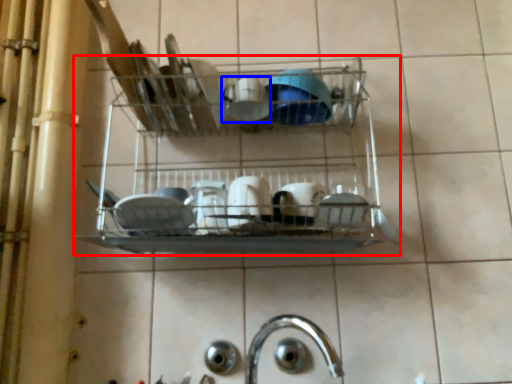
Question: Which object is further to the camera taking this photo, shelf (highlighted by a red box) or tableware (highlighted by a blue box)?

Choices:
 (A) shelf
 (B) tableware

Answer: (B)